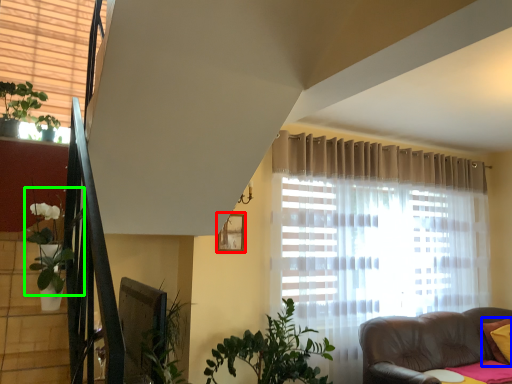
Question: Which object is positioned closest to picture frame (highlighted by a red box)? Select from pillow (highlighted by a blue box) and plant (highlighted by a green box).

Choices:
 (A) pillow
 (B) plant

Answer: (B)